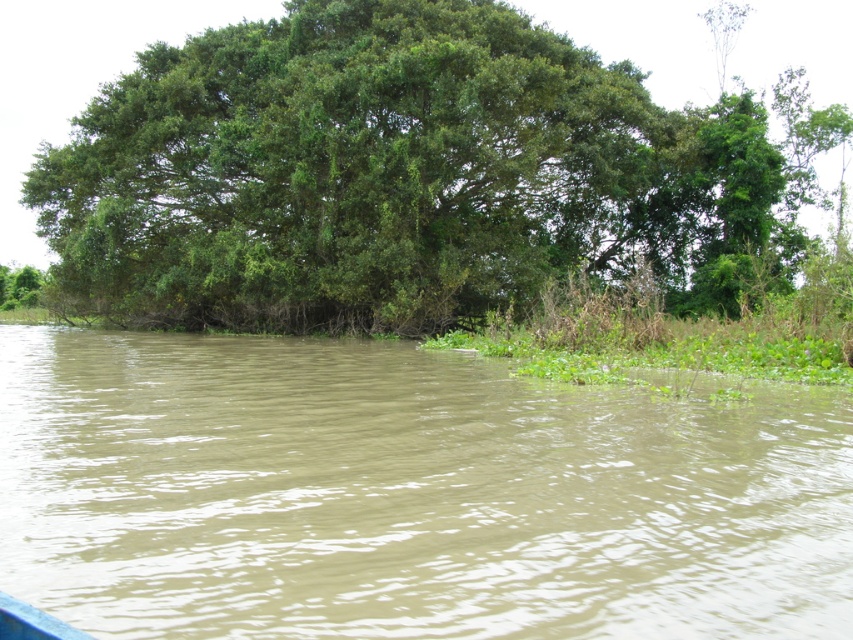
Does brown muddy water at center have a greater height compared to green leafy tree at upper center?

In fact, brown muddy water at center may be shorter than green leafy tree at upper center.

Locate an element on the screen. The height and width of the screenshot is (640, 853). brown muddy water at center is located at coordinates (408, 493).

Locate an element on the screen. This screenshot has width=853, height=640. brown muddy water at center is located at coordinates (408, 493).